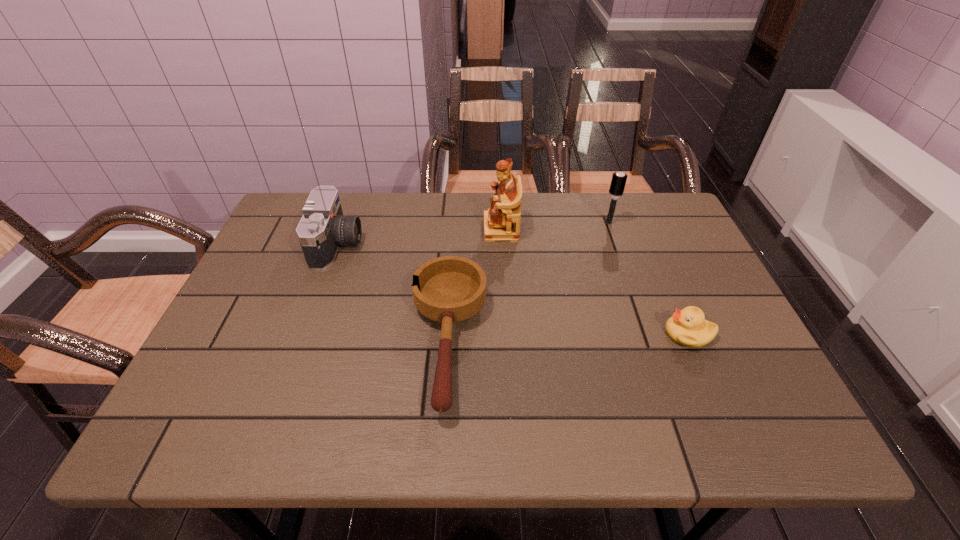
This screenshot has height=540, width=960. I want to click on vacant space in between the rightmost object and the third tallest object, so pos(513,289).

Identify the location of vacant point located between the rightmost object and the figurine. (594, 281).

At what (x,y) coordinates should I click in order to perform the action: click on vacant area that lies between the tallest object and the rightmost object. Please return your answer as a coordinate pair (x, y). The image size is (960, 540). Looking at the image, I should click on (594, 281).

Image resolution: width=960 pixels, height=540 pixels. Find the location of `unoccupied position between the second object from right to left and the duckling`. unoccupied position between the second object from right to left and the duckling is located at coordinates (649, 278).

What are the coordinates of `empty space that is in between the second object from right to left and the tallest object` in the screenshot? It's located at (555, 226).

I want to click on object that can be found as the closest to the hairbrush, so click(x=502, y=221).

Locate which object is the second closest to the tallest object. Please provide its 2D coordinates. Your answer should be formatted as a tuple, i.e. [(x, y)], where the tuple contains the x and y coordinates of a point satisfying the conditions above.

[(618, 181)]

Locate an element on the screen. blank area in the image that satisfies the following two spatial constraints: 1. on the front-facing side of the tallest object; 2. with the handle on the side of the saucepan is located at coordinates (507, 342).

At what (x,y) coordinates should I click in order to perform the action: click on vacant space that satisfies the following two spatial constraints: 1. on the front side of the second tallest object; 2. on the front-facing side of the figurine. Please return your answer as a coordinate pair (x, y). Looking at the image, I should click on (611, 229).

Locate an element on the screen. This screenshot has height=540, width=960. vacant space that satisfies the following two spatial constraints: 1. on the front side of the second object from right to left; 2. on the front-facing side of the camera is located at coordinates (616, 245).